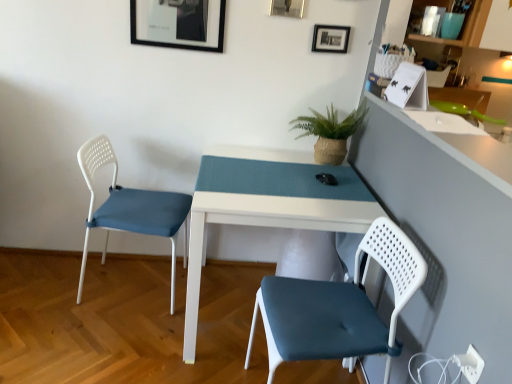
Identify the location of vacant region in front of green woven pot at upper center. The height and width of the screenshot is (384, 512). (331, 181).